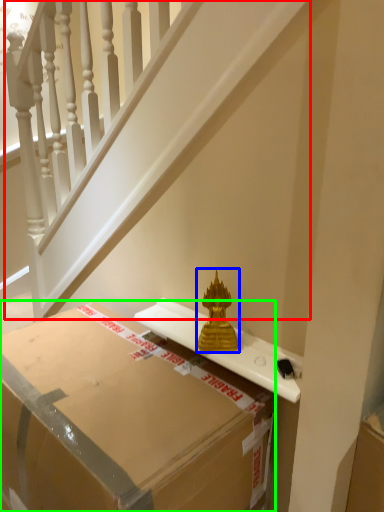
Question: Estimate the real-world distances between objects in this image. Which object is closer to stairwell (highlighted by a red box), sculpture (highlighted by a blue box) or box (highlighted by a green box)?

Choices:
 (A) sculpture
 (B) box

Answer: (B)